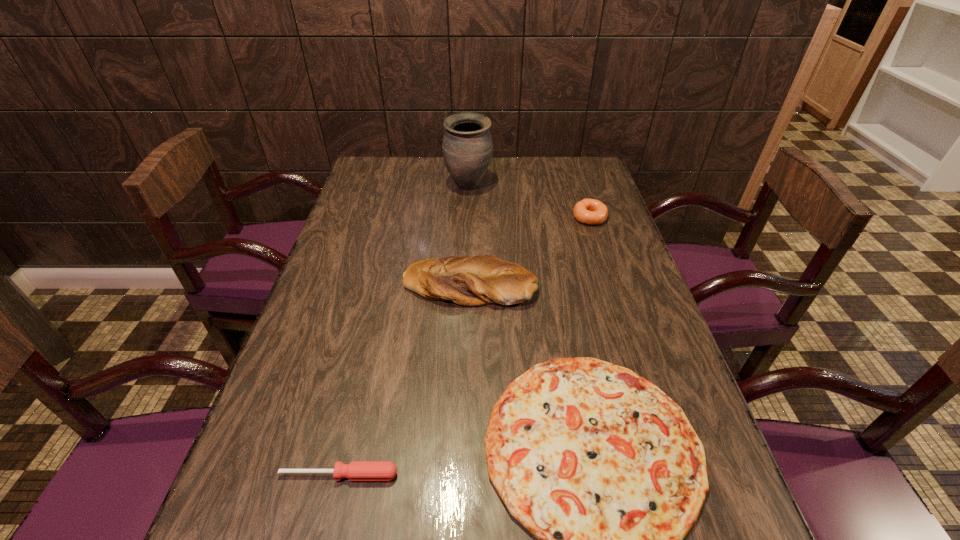
This screenshot has height=540, width=960. I want to click on vacant space situated 0.300m on the back of the fourth tallest object, so click(372, 339).

Locate an element on the screen. This screenshot has width=960, height=540. object positioned at the far edge is located at coordinates (467, 147).

Locate an element on the screen. The width and height of the screenshot is (960, 540). object that is at the left edge is located at coordinates (356, 470).

Find the location of `object positioned at the right edge`. object positioned at the right edge is located at coordinates (588, 211).

I want to click on free region at the far edge, so click(x=512, y=170).

You are a GUI agent. You are given a task and a screenshot of the screen. Output one action in this format:
    pyautogui.click(x=<x>, y=<y>)
    Task: Click on the vacant space at the left edge
    This screenshot has width=960, height=540.
    Given the screenshot: What is the action you would take?
    pyautogui.click(x=322, y=306)

Image resolution: width=960 pixels, height=540 pixels. In the image, there is a desktop. Identify the location of vacant space at the right edge. (596, 291).

Identify the location of vacant space at the far left corner. (384, 189).

At what (x,y) coordinates should I click in order to perform the action: click on vacant space at the far right corner of the desktop. Please return your answer as a coordinate pair (x, y). Looking at the image, I should click on (565, 158).

Identify the location of free space between the third farthest object and the urn. The height and width of the screenshot is (540, 960). (468, 235).